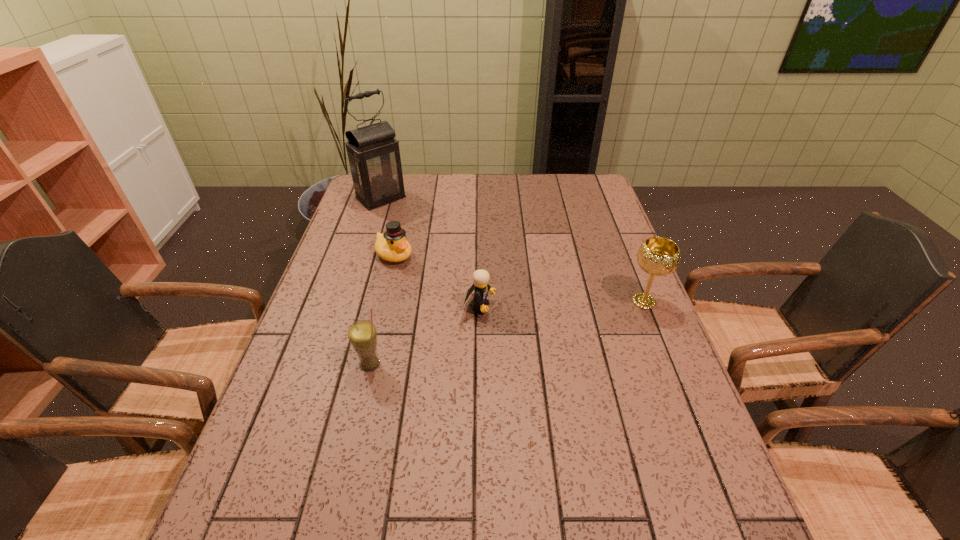
This screenshot has height=540, width=960. What are the coordinates of `free space that is in between the duck and the second object from right to left` in the screenshot? It's located at (437, 280).

The height and width of the screenshot is (540, 960). Identify the location of vacant space that's between the Lego and the straw for drinking. point(424,334).

This screenshot has height=540, width=960. In order to click on free spot between the straw for drinking and the fourth object from left to right in this screenshot , I will do `click(424, 334)`.

Identify the location of free space between the rightmost object and the farthest object. The height and width of the screenshot is (540, 960). (513, 249).

The image size is (960, 540). I want to click on free space that is in between the fourth object from left to right and the chalice, so click(562, 303).

Where is `the closest object to the Lego`? The image size is (960, 540). the closest object to the Lego is located at coordinates (392, 246).

Select which object appears as the second closest to the chalice. Please provide its 2D coordinates. Your answer should be formatted as a tuple, i.e. [(x, y)], where the tuple contains the x and y coordinates of a point satisfying the conditions above.

[(392, 246)]

Find the location of a particular element. The height and width of the screenshot is (540, 960). vacant space that satisfies the following two spatial constraints: 1. on the front side of the lantern; 2. on the right side of the straw for drinking is located at coordinates (326, 364).

I want to click on vacant region that satisfies the following two spatial constraints: 1. on the back side of the straw for drinking; 2. on the right side of the chalice, so click(385, 301).

Find the location of a particular element. The height and width of the screenshot is (540, 960). free point that satisfies the following two spatial constraints: 1. on the front side of the fourth object from left to right; 2. on the right side of the farthest object is located at coordinates (346, 305).